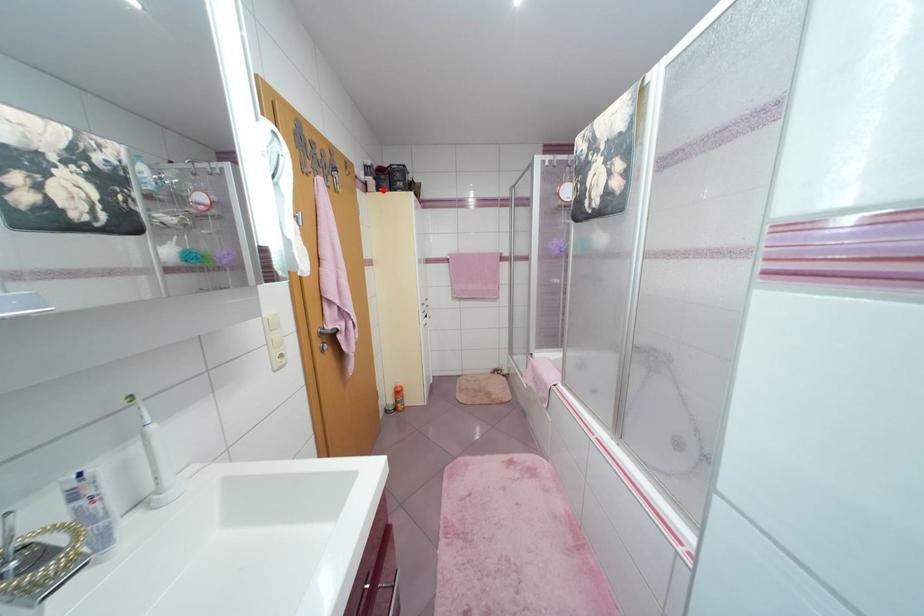
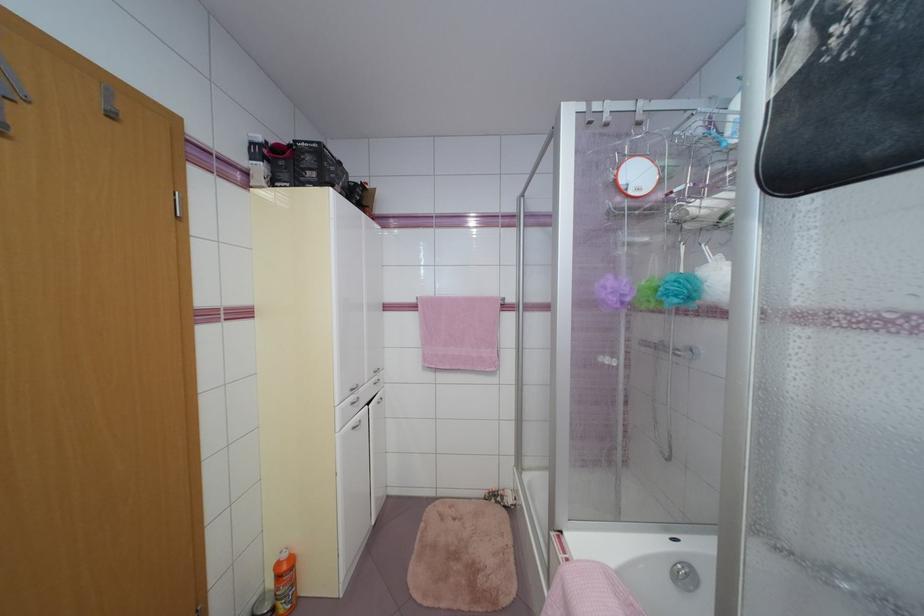
In the second image, find the point that corresponds to the highlighted location in the first image.

(276, 185)